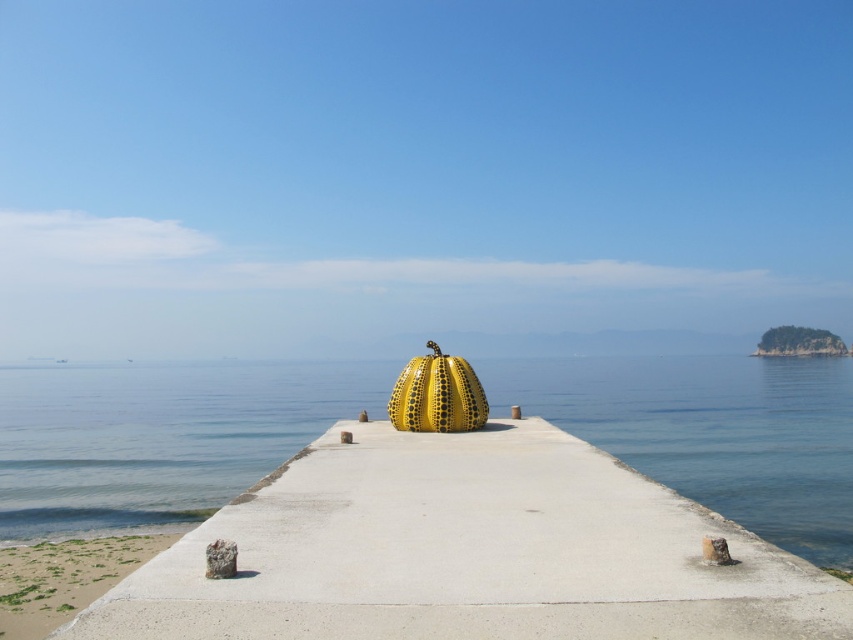
Question: Which of the following is the closest to the observer?

Choices:
 (A) green grassy sand at lower left
 (B) transparent blue water at center

Answer: (B)

Question: Considering the relative positions of transparent blue water at center and green grassy sand at lower left in the image provided, where is transparent blue water at center located with respect to green grassy sand at lower left?

Choices:
 (A) right
 (B) left

Answer: (B)

Question: Considering the relative positions of transparent blue water at center and green grassy sand at lower left in the image provided, where is transparent blue water at center located with respect to green grassy sand at lower left?

Choices:
 (A) left
 (B) right

Answer: (A)

Question: Which object is closer to the camera taking this photo?

Choices:
 (A) transparent blue water at center
 (B) green grassy sand at lower left

Answer: (A)

Question: Can you confirm if transparent blue water at center is wider than green grassy sand at lower left?

Choices:
 (A) yes
 (B) no

Answer: (A)